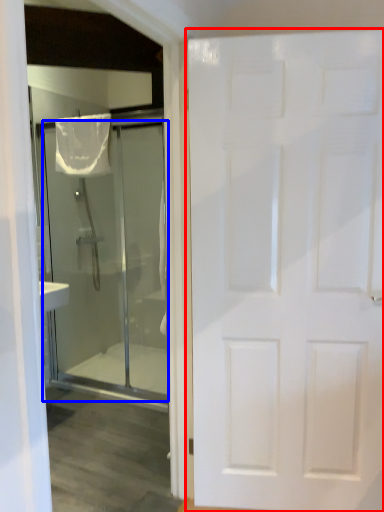
Question: Which point is further to the camera, door (highlighted by a red box) or door (highlighted by a blue box)?

Choices:
 (A) door
 (B) door

Answer: (B)